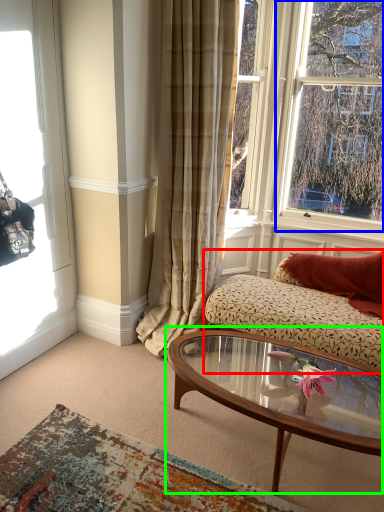
Question: Considering the real-world distances, which object is farthest from studio couch (highlighted by a red box)? window (highlighted by a blue box) or coffee table (highlighted by a green box)?

Choices:
 (A) window
 (B) coffee table

Answer: (A)